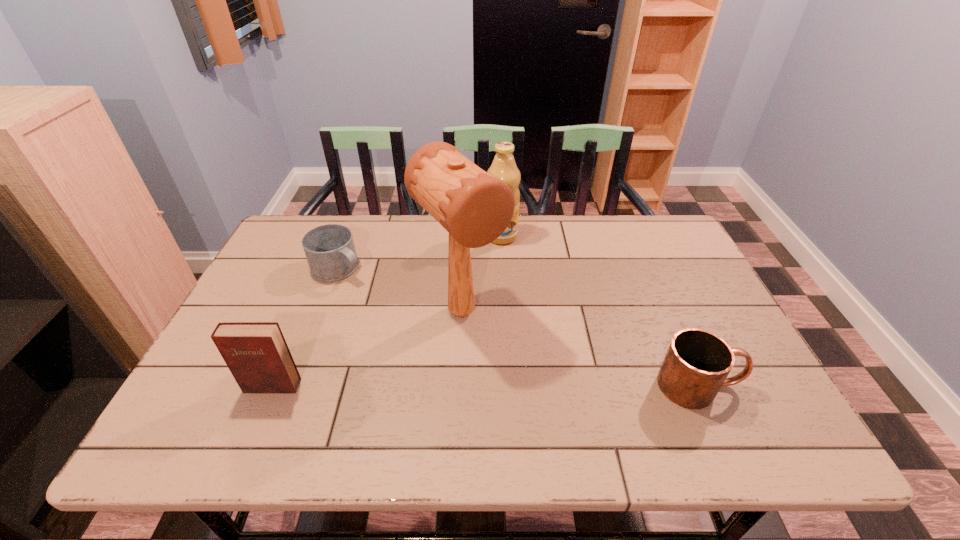
Where is `vacant spot on the desktop that is between the third tallest object and the right mug and is positioned on the label of the farthest object`? The height and width of the screenshot is (540, 960). vacant spot on the desktop that is between the third tallest object and the right mug and is positioned on the label of the farthest object is located at coordinates (532, 386).

This screenshot has width=960, height=540. Find the location of `vacant space on the desktop that is between the diary and the nearer mug and is positioned on the side of the farther mug with the handle`. vacant space on the desktop that is between the diary and the nearer mug and is positioned on the side of the farther mug with the handle is located at coordinates (512, 386).

Locate an element on the screen. The image size is (960, 540). free space on the desktop that is between the diary and the right mug and is positioned on the strike surface of the mallet is located at coordinates coord(526,386).